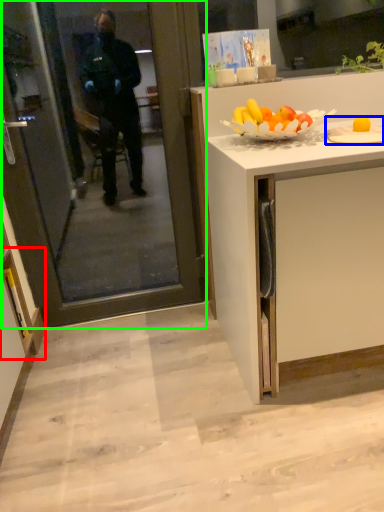
Question: Estimate the real-world distances between objects in this image. Which object is farther from cabinetry (highlighted by a red box), plate (highlighted by a blue box) or screen door (highlighted by a green box)?

Choices:
 (A) plate
 (B) screen door

Answer: (A)